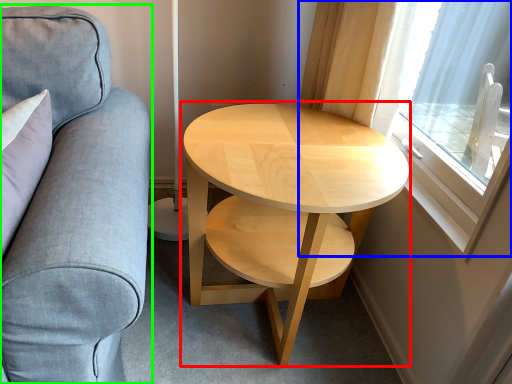
Question: Based on their relative distances, which object is farther from coffee table (highlighted by a red box)? Choose from window (highlighted by a blue box) and studio couch (highlighted by a green box).

Choices:
 (A) window
 (B) studio couch

Answer: (B)